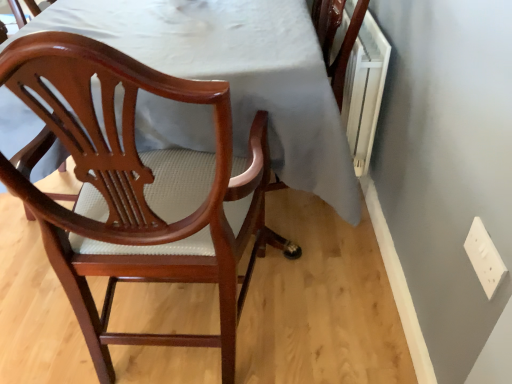
Question: Can you confirm if mahogany wood chair at left is wider than white plastic electric outlet at lower right?

Choices:
 (A) no
 (B) yes

Answer: (B)

Question: Is mahogany wood chair at left to the right of white plastic electric outlet at lower right from the viewer's perspective?

Choices:
 (A) no
 (B) yes

Answer: (A)

Question: Considering the relative positions of mahogany wood chair at left and white plastic electric outlet at lower right in the image provided, is mahogany wood chair at left to the left of white plastic electric outlet at lower right from the viewer's perspective?

Choices:
 (A) yes
 (B) no

Answer: (A)

Question: Does mahogany wood chair at left have a lesser height compared to white plastic electric outlet at lower right?

Choices:
 (A) yes
 (B) no

Answer: (B)

Question: Considering the relative sizes of mahogany wood chair at left and white plastic electric outlet at lower right in the image provided, is mahogany wood chair at left bigger than white plastic electric outlet at lower right?

Choices:
 (A) yes
 (B) no

Answer: (A)

Question: Could you tell me if mahogany wood chair at left is facing white plastic electric outlet at lower right?

Choices:
 (A) yes
 (B) no

Answer: (B)

Question: Is white plastic electric outlet at lower right surrounding mahogany wood chair at left?

Choices:
 (A) yes
 (B) no

Answer: (B)

Question: Is the depth of white plastic electric outlet at lower right less than that of mahogany wood chair at left?

Choices:
 (A) no
 (B) yes

Answer: (A)

Question: Can you confirm if white plastic electric outlet at lower right is thinner than mahogany wood chair at left?

Choices:
 (A) no
 (B) yes

Answer: (B)

Question: From the image's perspective, does white plastic electric outlet at lower right appear lower than mahogany wood chair at left?

Choices:
 (A) yes
 (B) no

Answer: (A)

Question: Is white plastic electric outlet at lower right facing away from mahogany wood chair at left?

Choices:
 (A) yes
 (B) no

Answer: (B)

Question: Does white plastic electric outlet at lower right have a larger size compared to mahogany wood chair at left?

Choices:
 (A) yes
 (B) no

Answer: (B)

Question: Considering the positions of white plastic electric outlet at lower right and mahogany wood chair at left in the image, is white plastic electric outlet at lower right taller or shorter than mahogany wood chair at left?

Choices:
 (A) short
 (B) tall

Answer: (A)